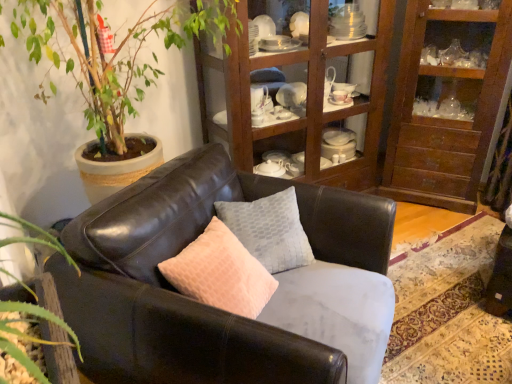
Question: Is point (123, 84) positioned closer to the camera than point (459, 187)?

Choices:
 (A) closer
 (B) farther

Answer: (A)

Question: Is green leafy plant at upper left in front of or behind wooden cabinet at upper center in the image?

Choices:
 (A) behind
 (B) front

Answer: (B)

Question: Estimate the real-world distances between objects in this image. Which object is closer to the textured gray pillow at center?

Choices:
 (A) wooden cabinet at upper right
 (B) wooden cabinet at upper center
 (C) green leafy plant at upper left
 (D) matte leather couch at center

Answer: (D)

Question: Estimate the real-world distances between objects in this image. Which object is closer to the wooden cabinet at upper right?

Choices:
 (A) textured gray pillow at center
 (B) matte leather couch at center
 (C) green leafy plant at upper left
 (D) wooden cabinet at upper center

Answer: (D)